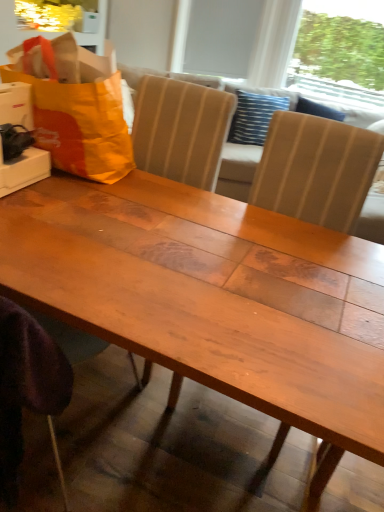
Question: In terms of height, does transparent plastic window screen at upper right, which ranks as the first window screen in right-to-left order, look taller or shorter compared to white matte window screen at upper center, which is the second window screen in right-to-left order?

Choices:
 (A) tall
 (B) short

Answer: (A)

Question: Looking at their shapes, would you say transparent plastic window screen at upper right, which ranks as the first window screen in right-to-left order, is wider or thinner than white matte window screen at upper center, which is the second window screen in right-to-left order?

Choices:
 (A) thin
 (B) wide

Answer: (B)

Question: Considering the real-world distances, which object is closest to the wooden table at center?

Choices:
 (A) transparent plastic window screen at upper right, which is counted as the 2th window screen, starting from the left
 (B) blue striped pillow at upper center
 (C) orange fabric grocery bag at upper left
 (D) white matte window screen at upper center, the 1th window screen in the left-to-right sequence

Answer: (C)

Question: Based on their relative distances, which object is nearer to the transparent plastic window screen at upper right, which ranks as the first window screen in right-to-left order?

Choices:
 (A) blue striped pillow at upper center
 (B) white matte window screen at upper center, the 1th window screen in the left-to-right sequence
 (C) orange fabric grocery bag at upper left
 (D) wooden table at center

Answer: (B)